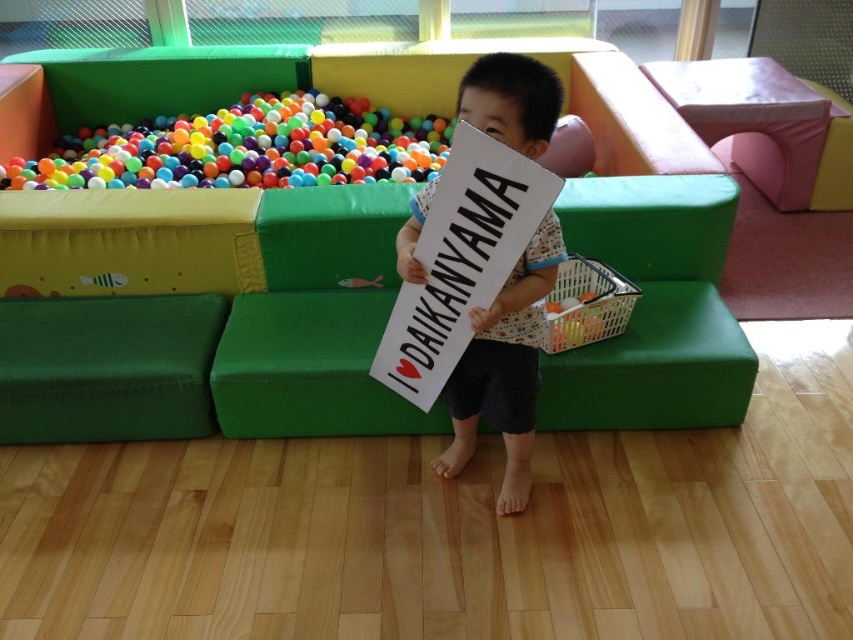
Who is lower down, green fabric couch at center or white cardboard sign at center?

Positioned lower is green fabric couch at center.

Does green fabric couch at center appear on the right side of white cardboard sign at center?

In fact, green fabric couch at center is to the left of white cardboard sign at center.

Describe the element at coordinates (224, 340) in the screenshot. This screenshot has width=853, height=640. I see `green fabric couch at center` at that location.

I want to click on green fabric couch at center, so click(224, 340).

Does multicolored plastic balls at upper left appear over white cardboard sign at center?

Yes.

Which is more to the right, multicolored plastic balls at upper left or white cardboard sign at center?

Positioned to the right is white cardboard sign at center.

This screenshot has height=640, width=853. What are the coordinates of `multicolored plastic balls at upper left` in the screenshot? It's located at (245, 148).

Measure the distance between point [341,276] and camera.

Point [341,276] and camera are 8.19 feet apart.

Between green fabric couch at center and multicolored plastic balls at upper left, which one appears on the left side from the viewer's perspective?

multicolored plastic balls at upper left

Who is more distant from viewer, (181, 346) or (556, 140)?

Point (556, 140)

What are the coordinates of `green fabric couch at center` in the screenshot? It's located at (224, 340).